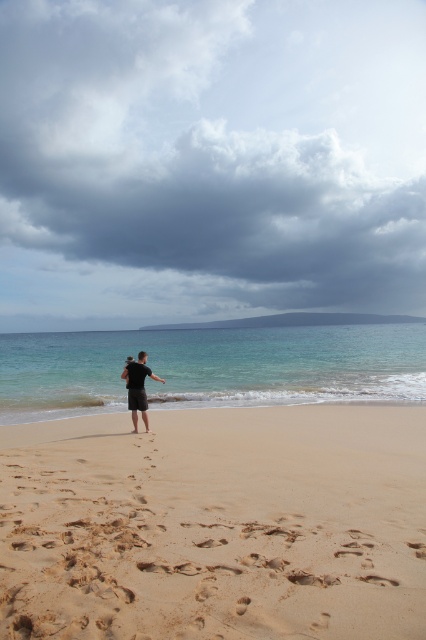
From the picture: Does brown sandy beach at center appear on the left side of dark brown shorts at center?

In fact, brown sandy beach at center is to the right of dark brown shorts at center.

Is point (140, 604) positioned before point (126, 365)?

Yes.

This screenshot has width=426, height=640. I want to click on brown sandy beach at center, so click(x=215, y=524).

Can you confirm if cloudy sky at upper center is shorter than brown sandy beach at center?

No, cloudy sky at upper center is not shorter than brown sandy beach at center.

Locate an element on the screen. This screenshot has width=426, height=640. cloudy sky at upper center is located at coordinates (210, 160).

Can you confirm if cloudy sky at upper center is positioned to the left of dark brown shorts at center?

Yes, cloudy sky at upper center is to the left of dark brown shorts at center.

Is point (60, 60) positioned behind point (132, 419)?

Yes, point (60, 60) is behind point (132, 419).

You are a GUI agent. You are given a task and a screenshot of the screen. Output one action in this format:
    pyautogui.click(x=<x>, y=<y>)
    Task: Click on the cloudy sky at upper center
    The height and width of the screenshot is (640, 426).
    Given the screenshot: What is the action you would take?
    pyautogui.click(x=210, y=160)